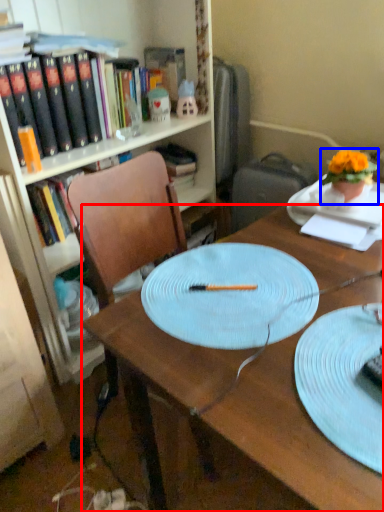
Question: Which of the following is the closest to the observer, desk (highlighted by a red box) or houseplant (highlighted by a blue box)?

Choices:
 (A) desk
 (B) houseplant

Answer: (A)